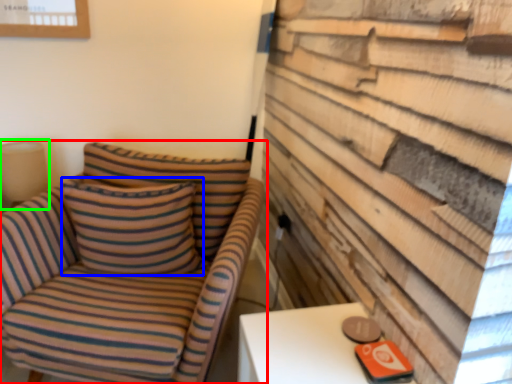
Question: Estimate the real-world distances between objects in this image. Which object is closer to chair (highlighted by a red box), pillow (highlighted by a blue box) or table lamp (highlighted by a green box)?

Choices:
 (A) pillow
 (B) table lamp

Answer: (A)